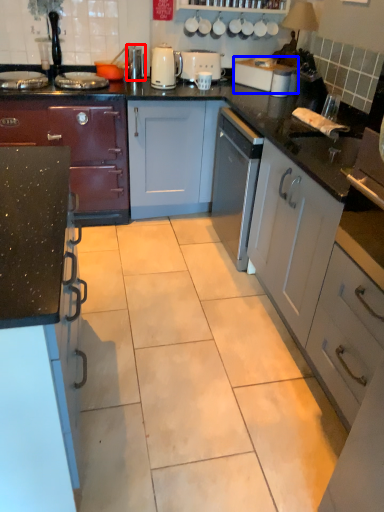
Question: Which point is closer to the camera, appliance (highlighted by a red box) or toaster (highlighted by a blue box)?

Choices:
 (A) appliance
 (B) toaster

Answer: (B)